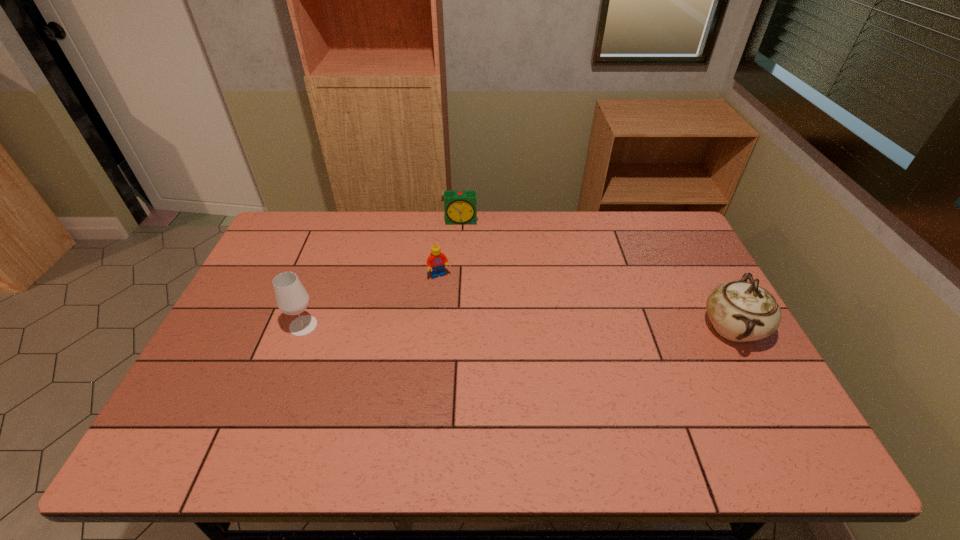
This screenshot has width=960, height=540. In order to click on vacant space located 0.170m on the face of the Lego in this screenshot , I will do `click(461, 321)`.

The width and height of the screenshot is (960, 540). What are the coordinates of `blank area located 0.210m on the face of the Lego` in the screenshot? It's located at (466, 331).

Locate an element on the screen. object located at the far edge is located at coordinates (460, 207).

This screenshot has width=960, height=540. I want to click on object that is at the right edge, so click(x=740, y=311).

Identify the location of vacant space at the far edge. The height and width of the screenshot is (540, 960). (579, 237).

This screenshot has width=960, height=540. In the image, there is a desktop. In order to click on vacant space at the near edge in this screenshot , I will do `click(534, 396)`.

The width and height of the screenshot is (960, 540). What are the coordinates of `free region at the left edge of the desktop` in the screenshot? It's located at (208, 367).

Locate an element on the screen. The width and height of the screenshot is (960, 540). free space at the right edge of the desktop is located at coordinates (742, 365).

The image size is (960, 540). What are the coordinates of `free space at the far left corner` in the screenshot? It's located at (286, 213).

Locate an element on the screen. The width and height of the screenshot is (960, 540). vacant space at the near left corner of the desktop is located at coordinates (205, 410).